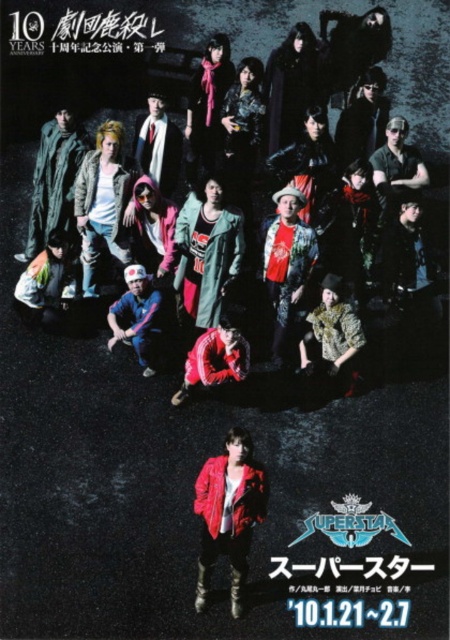
Question: Does shiny red leather jacket at center have a greater width compared to green textured jacket at left?

Choices:
 (A) yes
 (B) no

Answer: (B)

Question: Which object is the farthest from the denim jacket at center?

Choices:
 (A) red satin shirt at center
 (B) red leather jacket at center
 (C) green textured jacket at left

Answer: (B)

Question: Is matte black jacket at upper center to the left of red leather jacket at center from the viewer's perspective?

Choices:
 (A) yes
 (B) no

Answer: (B)

Question: Estimate the real-world distances between objects in this image. Which object is closer to the matte black scarf at upper center?

Choices:
 (A) black velvet coat at upper center
 (B) green matte jacket at center
 (C) denim jacket at center

Answer: (A)

Question: Which object appears closest to the camera in this image?

Choices:
 (A) green fabric scarf at lower left
 (B) green matte jacket at center

Answer: (B)

Question: Does black velvet coat at upper center have a smaller size compared to white scarf at center?

Choices:
 (A) yes
 (B) no

Answer: (B)